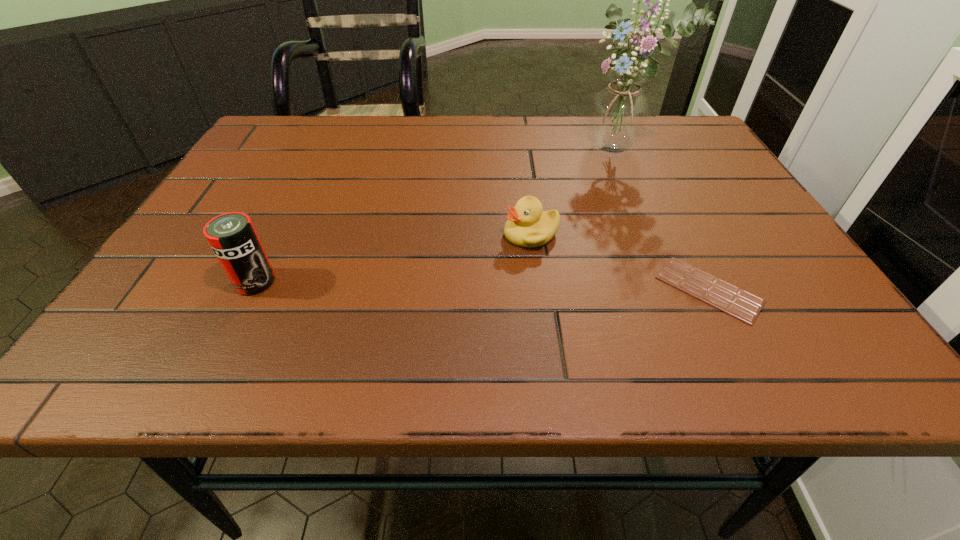
The width and height of the screenshot is (960, 540). I want to click on can, so coord(232,236).

Image resolution: width=960 pixels, height=540 pixels. I want to click on the second tallest object, so click(x=232, y=236).

In order to click on the shortest object in this screenshot , I will do `click(745, 306)`.

The height and width of the screenshot is (540, 960). Identify the location of the tallest object. (618, 117).

At what (x,y) coordinates should I click in order to perform the action: click on bouquet. Please return your answer as a coordinate pair (x, y). The height and width of the screenshot is (540, 960). Looking at the image, I should click on (618, 117).

You are a GUI agent. You are given a task and a screenshot of the screen. Output one action in this format:
    pyautogui.click(x=<x>, y=<y>)
    Task: Click on the third tallest object
    The width and height of the screenshot is (960, 540).
    Given the screenshot: What is the action you would take?
    pyautogui.click(x=528, y=225)

The width and height of the screenshot is (960, 540). In order to click on duckling in this screenshot , I will do `click(528, 225)`.

I want to click on free region located 0.130m on the right of the third shortest object, so click(347, 282).

The height and width of the screenshot is (540, 960). In order to click on vacant space located on the back of the chocolate bar in this screenshot , I will do `click(656, 184)`.

Image resolution: width=960 pixels, height=540 pixels. What are the coordinates of `vacant space located 0.130m on the front-facing side of the tallest object` in the screenshot? It's located at (578, 192).